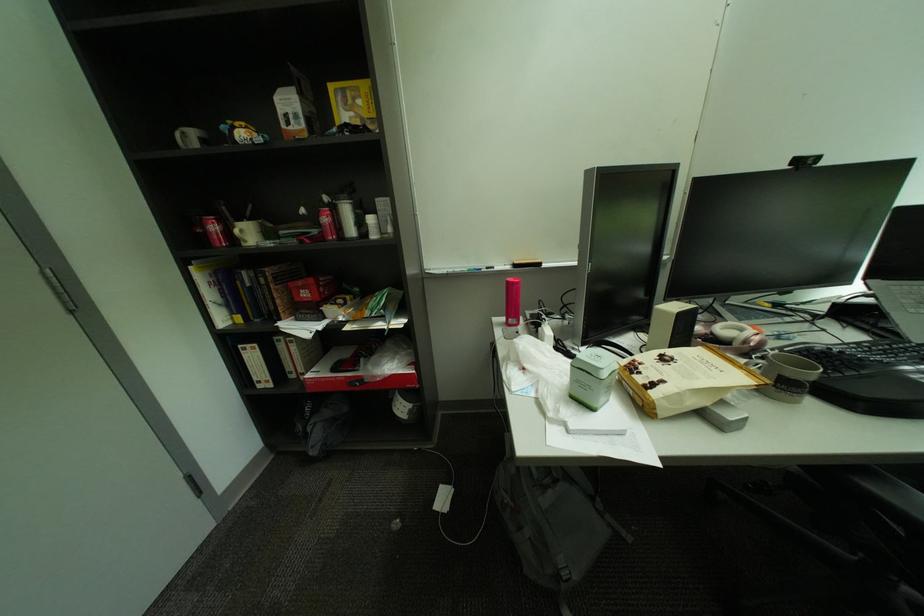
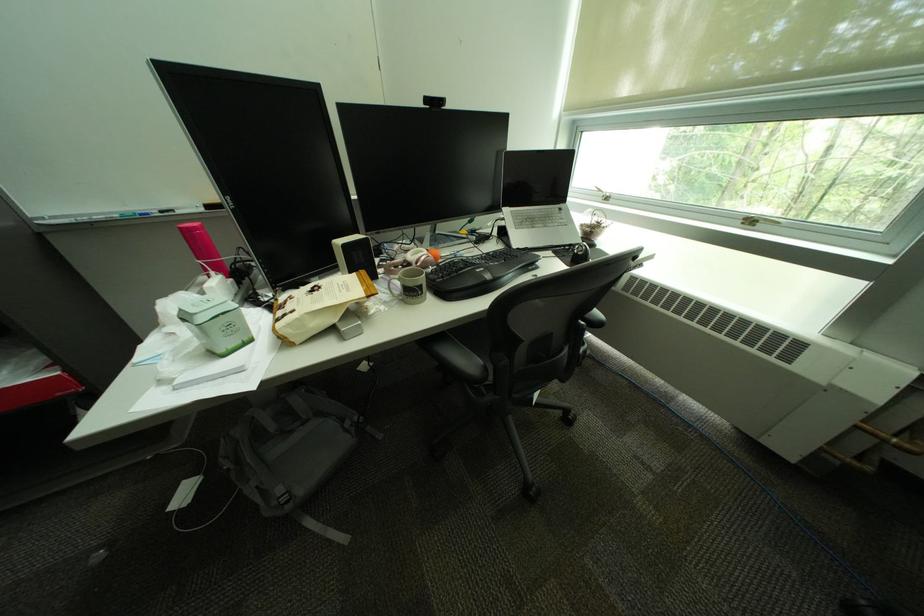
In the second image, find the point that corresponds to [604,407] in the first image.

(232, 353)